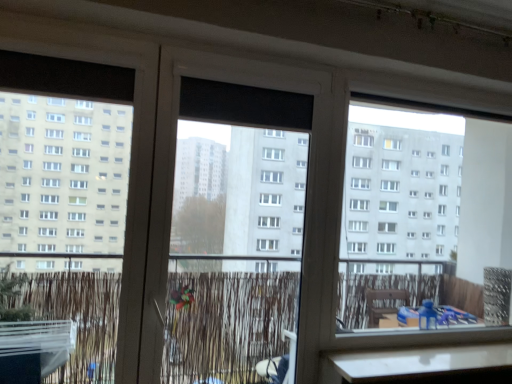
Question: Does point (212, 114) appear closer or farther from the camera than point (314, 190)?

Choices:
 (A) farther
 (B) closer

Answer: (B)

Question: From the image's perspective, is black matte window screen at center positioned above or below transparent plastic screen door at center?

Choices:
 (A) above
 (B) below

Answer: (A)

Question: Is black matte window screen at center taller or shorter than transparent plastic screen door at center?

Choices:
 (A) short
 (B) tall

Answer: (A)

Question: Is transparent plastic screen door at center inside the boundaries of black matte window screen at center, or outside?

Choices:
 (A) outside
 (B) inside

Answer: (A)

Question: Considering the positions of transparent plastic screen door at center and black matte window screen at center in the image, is transparent plastic screen door at center taller or shorter than black matte window screen at center?

Choices:
 (A) short
 (B) tall

Answer: (B)

Question: Considering the positions of point (221, 86) and point (218, 89), is point (221, 86) closer or farther from the camera than point (218, 89)?

Choices:
 (A) closer
 (B) farther

Answer: (B)

Question: From the image's perspective, relative to black matte window screen at center, is transparent plastic screen door at center above or below?

Choices:
 (A) above
 (B) below

Answer: (B)